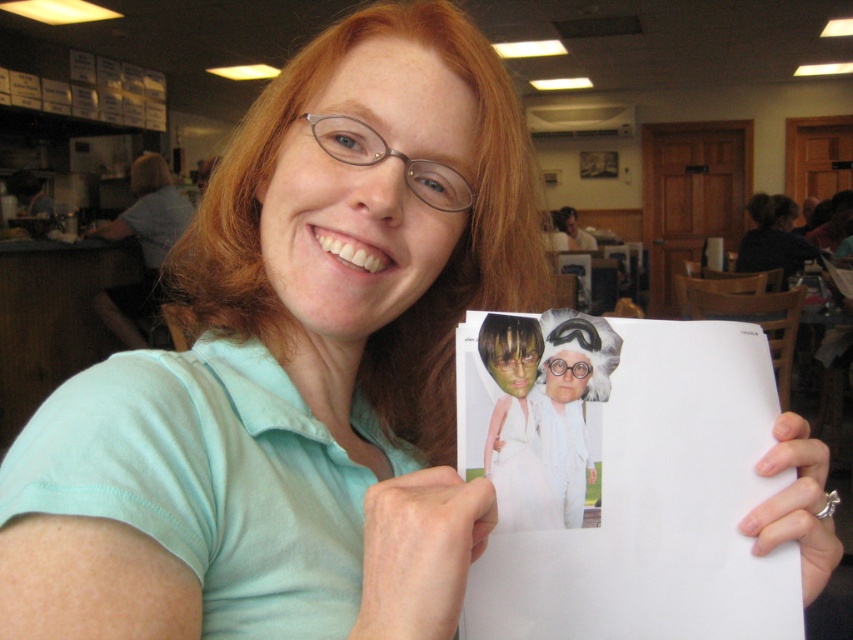
Question: Can you confirm if matte white dress at center is smaller than white paper at center?

Choices:
 (A) no
 (B) yes

Answer: (A)

Question: Which point is farther to the camera?

Choices:
 (A) white paper at center
 (B) matte white dress at center

Answer: (A)

Question: Which point is farther to the camera?

Choices:
 (A) (486, 333)
 (B) (596, 337)

Answer: (B)

Question: Where is matte white dress at center located in relation to white paper at center in the image?

Choices:
 (A) below
 (B) above

Answer: (A)

Question: Is matte white dress at center thinner than white paper at center?

Choices:
 (A) no
 (B) yes

Answer: (B)

Question: Among these objects, which one is farthest from the camera?

Choices:
 (A) white paper at center
 (B) matte white dress at center

Answer: (A)